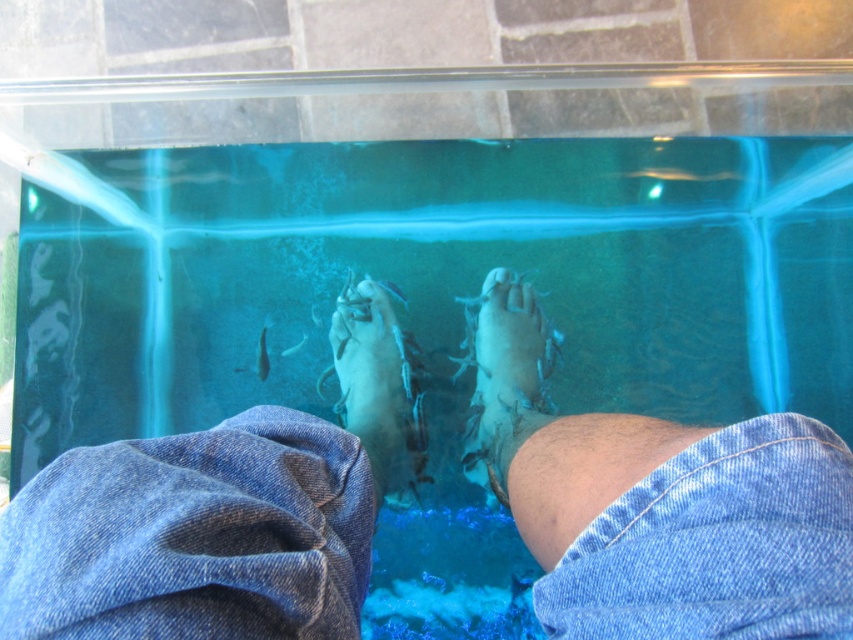
Question: Which point is closer to the camera?

Choices:
 (A) white matte foot at center
 (B) white matte fish spa at center

Answer: (B)

Question: Based on their relative distances, which object is nearer to the white matte fish spa at center?

Choices:
 (A) white matte foot at center
 (B) denim at lower center

Answer: (A)

Question: Is denim at lower center thinner than white matte foot at center?

Choices:
 (A) yes
 (B) no

Answer: (B)

Question: Is white matte foot at center above white matte fish spa at center?

Choices:
 (A) no
 (B) yes

Answer: (B)

Question: Observing the image, what is the correct spatial positioning of denim at lower center in reference to white matte fish spa at center?

Choices:
 (A) below
 (B) above

Answer: (A)

Question: Estimate the real-world distances between objects in this image. Which object is closer to the white matte foot at center?

Choices:
 (A) denim at lower center
 (B) white matte fish spa at center

Answer: (B)